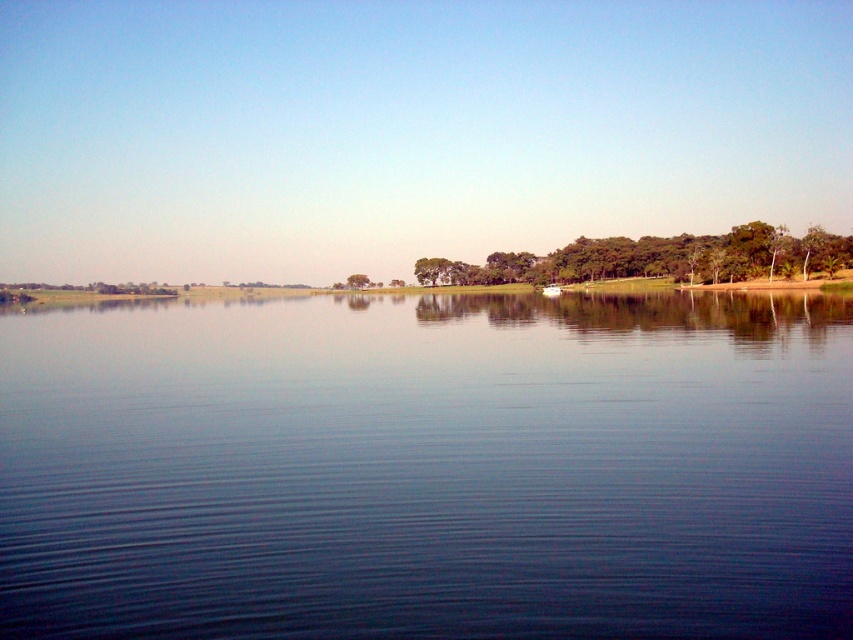
Describe the element at coordinates (428, 467) in the screenshot. The height and width of the screenshot is (640, 853). I see `blue smooth water at center` at that location.

How far apart are blue smooth water at center and green leafy trees at center?

A distance of 91.99 meters exists between blue smooth water at center and green leafy trees at center.

What are the coordinates of `blue smooth water at center` in the screenshot? It's located at (428, 467).

Does blue smooth water at center lie in front of green leafy tree at center?

Yes, it is in front of green leafy tree at center.

Can you confirm if blue smooth water at center is taller than green leafy tree at center?

No, blue smooth water at center is not taller than green leafy tree at center.

Between point (680, 554) and point (360, 284), which one is positioned in front?

Positioned in front is point (680, 554).

This screenshot has width=853, height=640. Identify the location of blue smooth water at center. (428, 467).

Can you confirm if green leafy trees at center is positioned below green leafy tree at center?

No.

Does green leafy trees at center appear over green leafy tree at center?

Yes, green leafy trees at center is above green leafy tree at center.

At what (x,y) coordinates should I click in order to perform the action: click on green leafy trees at center. Please return your answer as a coordinate pair (x, y). This screenshot has width=853, height=640. Looking at the image, I should click on tap(654, 259).